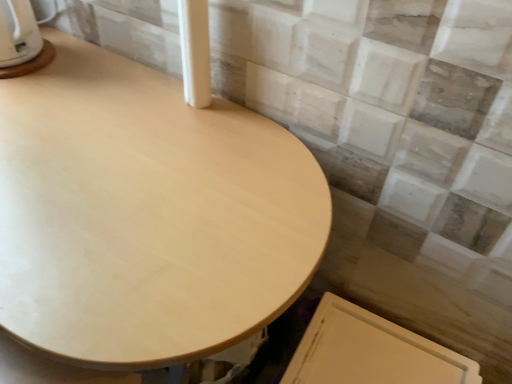
You are a GUI agent. You are given a task and a screenshot of the screen. Output one action in this format:
    pyautogui.click(x=<x>, y=<y>)
    Task: Click on the empty space that is ontop of light wood table at center (from a real-world perspective)
    
    Given the screenshot: What is the action you would take?
    pyautogui.click(x=115, y=147)